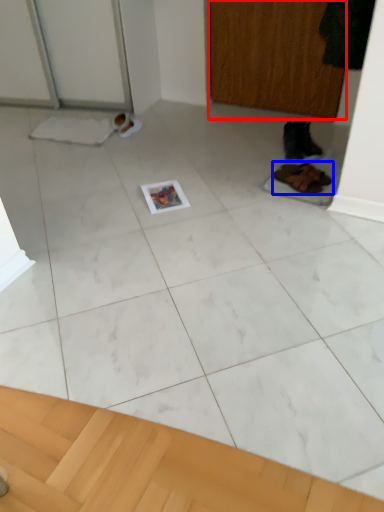
Question: Which point is further to the camera, screen door (highlighted by a red box) or footwear (highlighted by a blue box)?

Choices:
 (A) screen door
 (B) footwear

Answer: (A)